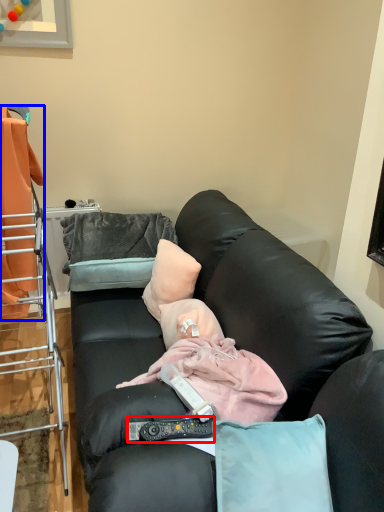
Question: Which object appears farthest to the camera in this image, remote control (highlighted by a red box) or laundry (highlighted by a blue box)?

Choices:
 (A) remote control
 (B) laundry

Answer: (B)